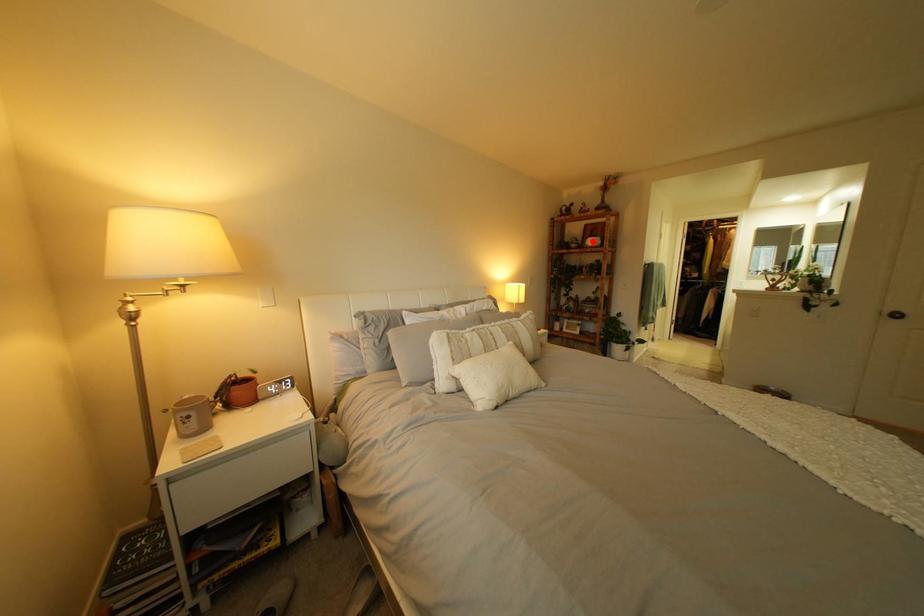
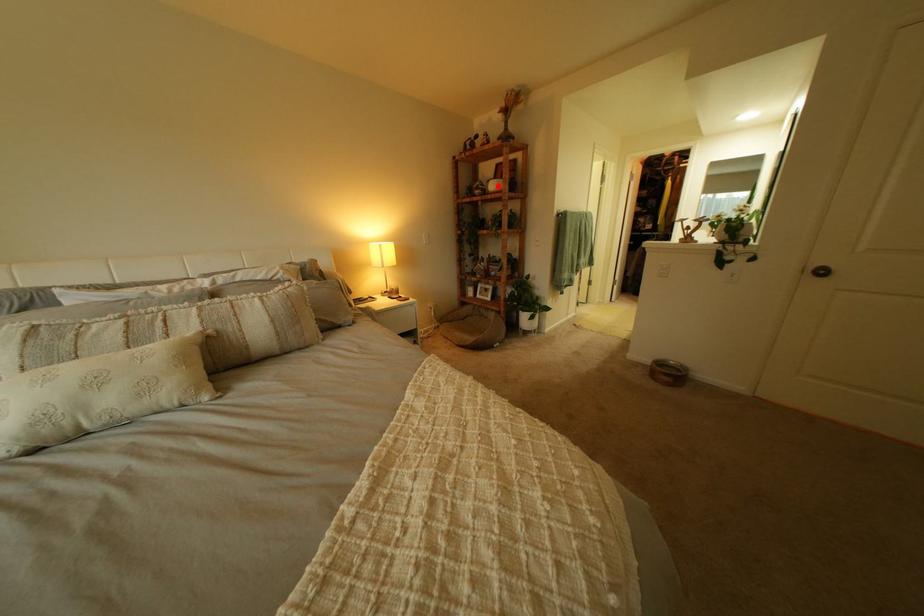
I am providing you with two images of the same scene from different viewpoints. A red point is marked on the first image and another point is marked on the second image. Do the highlighted points in image1 and image2 indicate the same real-world spot?

Yes